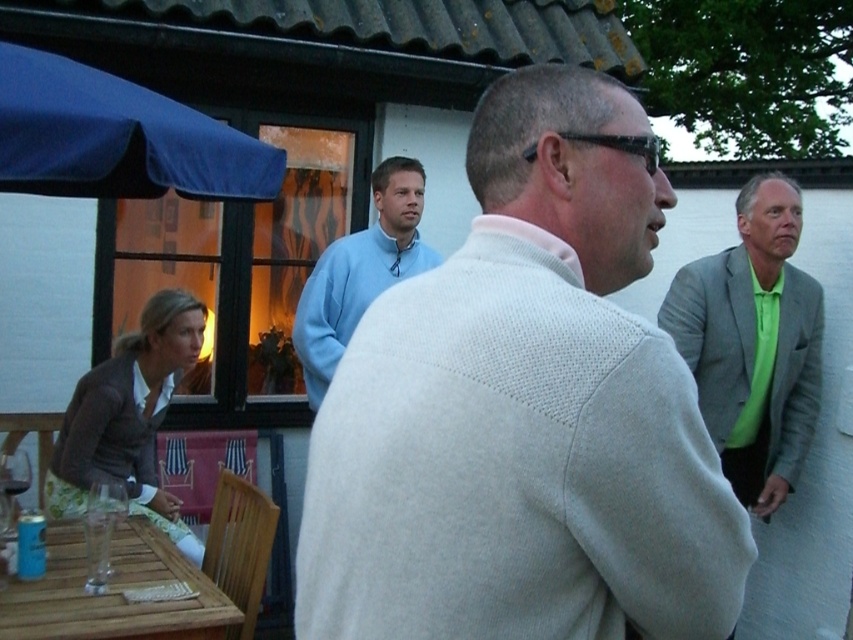
Question: Is wooden table at lower left above light blue sweater at center?

Choices:
 (A) no
 (B) yes

Answer: (A)

Question: Which point appears farthest from the camera in this image?

Choices:
 (A) (701, 324)
 (B) (479, 403)

Answer: (A)

Question: Does light gray sweater at center come in front of light gray wool sweater at right?

Choices:
 (A) yes
 (B) no

Answer: (A)

Question: Which object is closer to the camera taking this photo?

Choices:
 (A) wooden table at lower left
 (B) light gray sweater at center

Answer: (B)

Question: Which of the following is the farthest from the observer?

Choices:
 (A) (635, 221)
 (B) (799, 451)
 (C) (421, 256)

Answer: (C)

Question: Does light gray wool sweater at right have a lesser width compared to wooden table at lower left?

Choices:
 (A) no
 (B) yes

Answer: (B)